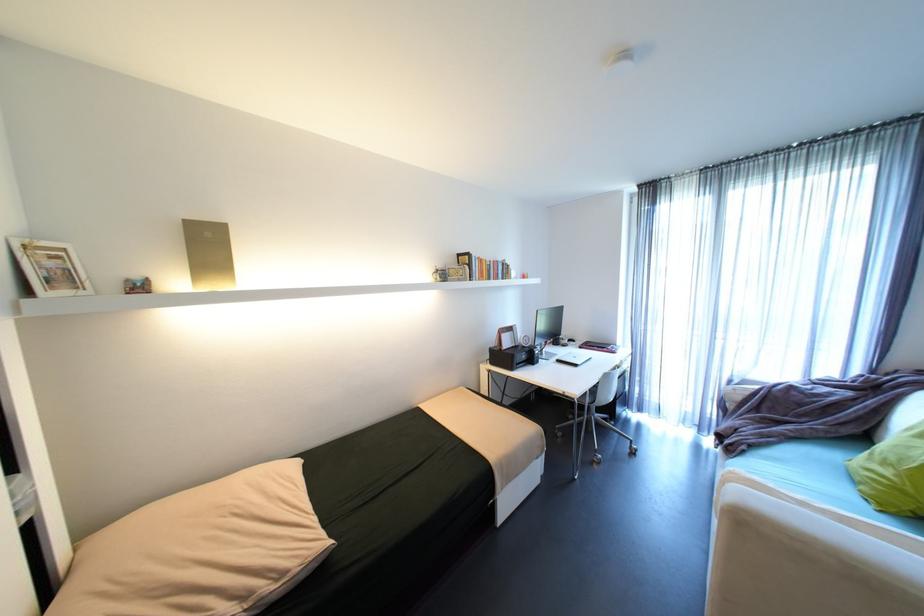
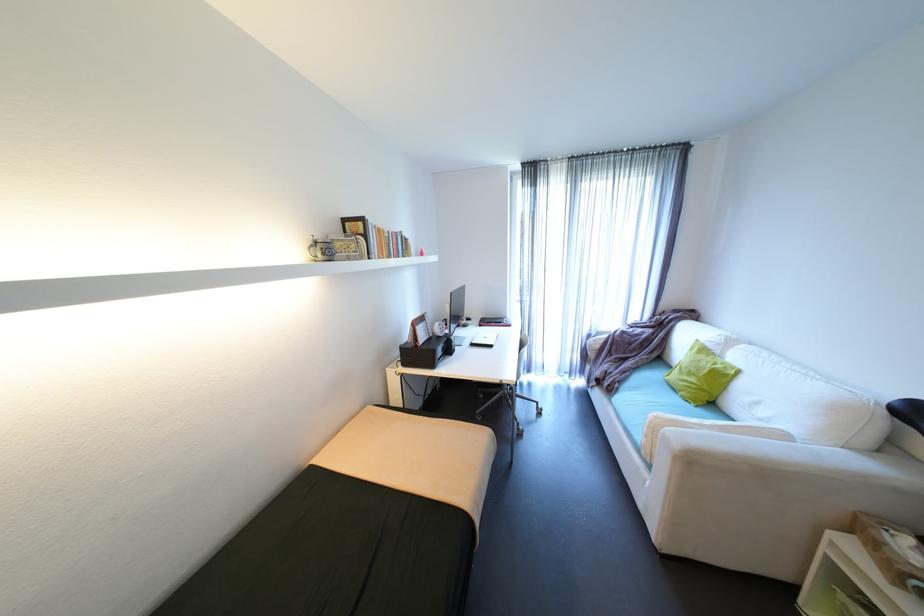
Locate, in the second image, the point that corresponds to point 480,278 in the first image.

(380, 254)